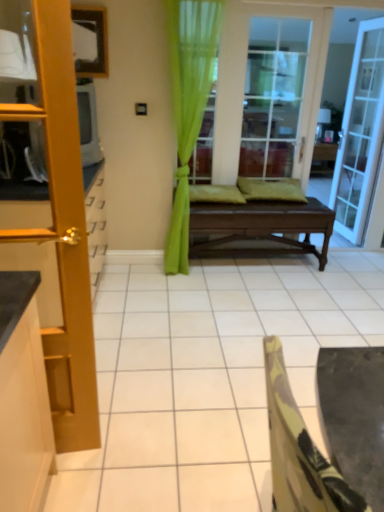
The width and height of the screenshot is (384, 512). Find the location of `empty space that is ontop of clear glass door at center (from a real-world perspective)`. empty space that is ontop of clear glass door at center (from a real-world perspective) is located at coordinates point(284,3).